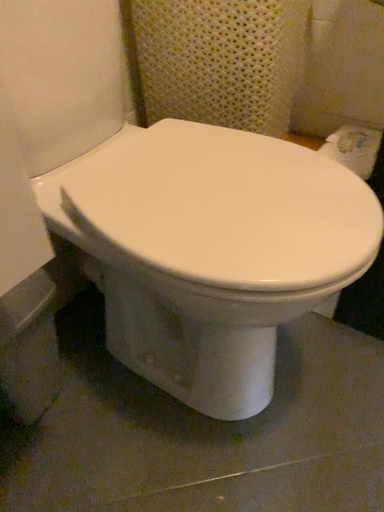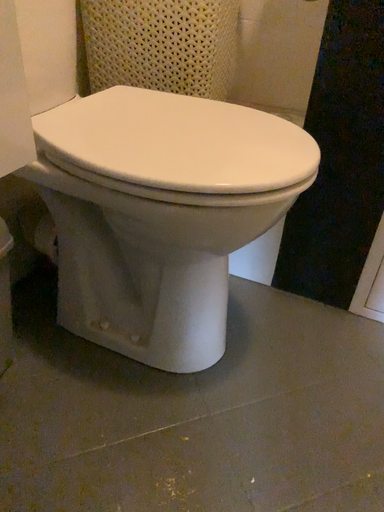
Question: How did the camera likely rotate when shooting the video?

Choices:
 (A) rotated right
 (B) rotated left

Answer: (A)